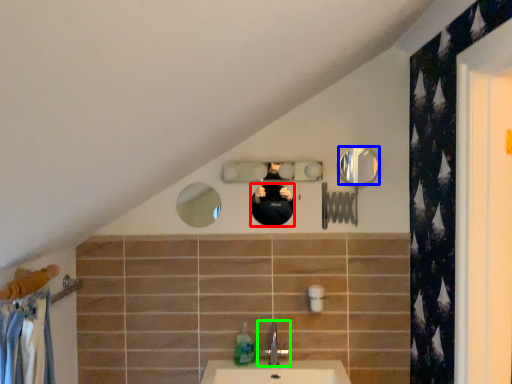
Question: Based on their relative distances, which object is nearer to mirror (highlighted by a red box)? Choose from mirror (highlighted by a blue box) and tap (highlighted by a green box).

Choices:
 (A) mirror
 (B) tap

Answer: (A)